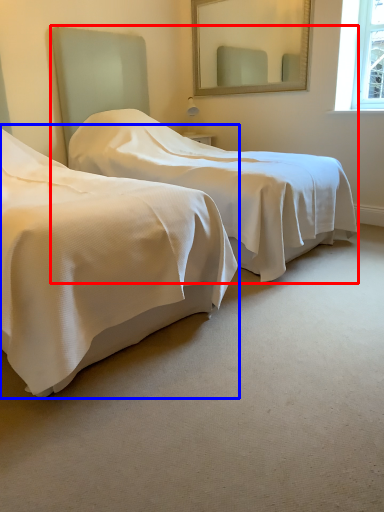
Question: Which point is closer to the camera, bed (highlighted by a red box) or bed (highlighted by a blue box)?

Choices:
 (A) bed
 (B) bed

Answer: (B)